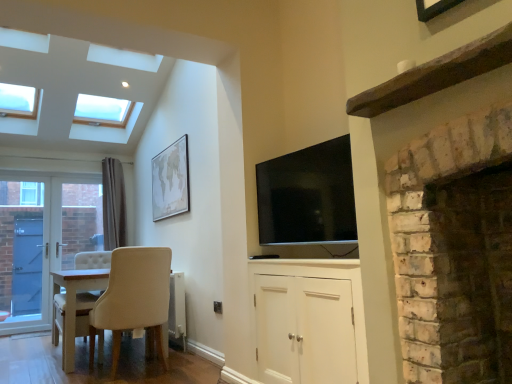
Question: Can you confirm if flat screen tv at upper center is bigger than beige matte map at upper center?

Choices:
 (A) no
 (B) yes

Answer: (B)

Question: Is flat screen tv at upper center shorter than beige matte map at upper center?

Choices:
 (A) yes
 (B) no

Answer: (A)

Question: Is flat screen tv at upper center smaller than beige matte map at upper center?

Choices:
 (A) yes
 (B) no

Answer: (B)

Question: Is flat screen tv at upper center turned away from beige matte map at upper center?

Choices:
 (A) yes
 (B) no

Answer: (B)

Question: From the image's perspective, is flat screen tv at upper center located above beige matte map at upper center?

Choices:
 (A) yes
 (B) no

Answer: (B)

Question: Based on their sizes in the image, would you say blue glass door at left is bigger or smaller than white brick fireplace at right?

Choices:
 (A) big
 (B) small

Answer: (B)

Question: From the image's perspective, relative to white brick fireplace at right, is blue glass door at left above or below?

Choices:
 (A) above
 (B) below

Answer: (B)

Question: Would you say blue glass door at left is to the left or to the right of white brick fireplace at right in the picture?

Choices:
 (A) left
 (B) right

Answer: (A)

Question: Is blue glass door at left inside or outside of white brick fireplace at right?

Choices:
 (A) outside
 (B) inside

Answer: (A)

Question: From the image's perspective, is beige fabric chair at lower left above or below white brick fireplace at right?

Choices:
 (A) below
 (B) above

Answer: (A)

Question: In the image, is beige fabric chair at lower left on the left side or the right side of white brick fireplace at right?

Choices:
 (A) right
 (B) left

Answer: (B)

Question: In the image, is beige fabric chair at lower left positioned in front of or behind white brick fireplace at right?

Choices:
 (A) behind
 (B) front

Answer: (A)

Question: Choose the correct answer: Is beige fabric chair at lower left inside white brick fireplace at right or outside it?

Choices:
 (A) outside
 (B) inside

Answer: (A)

Question: Would you say white wooden door at left is inside or outside white matte cabinet at center?

Choices:
 (A) outside
 (B) inside

Answer: (A)

Question: In terms of height, does white wooden door at left look taller or shorter compared to white matte cabinet at center?

Choices:
 (A) short
 (B) tall

Answer: (B)